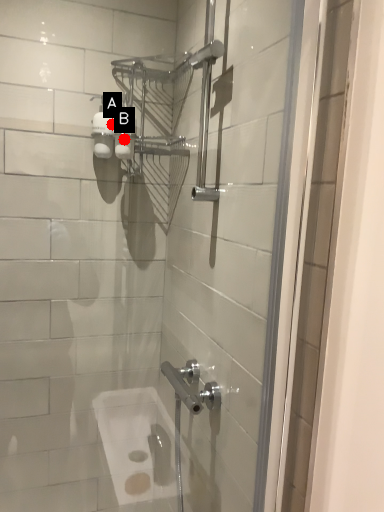
Question: Two points are circled on the image, labeled by A and B beside each circle. Which of the following is the farthest from the observer?

Choices:
 (A) A is further
 (B) B is further

Answer: (B)